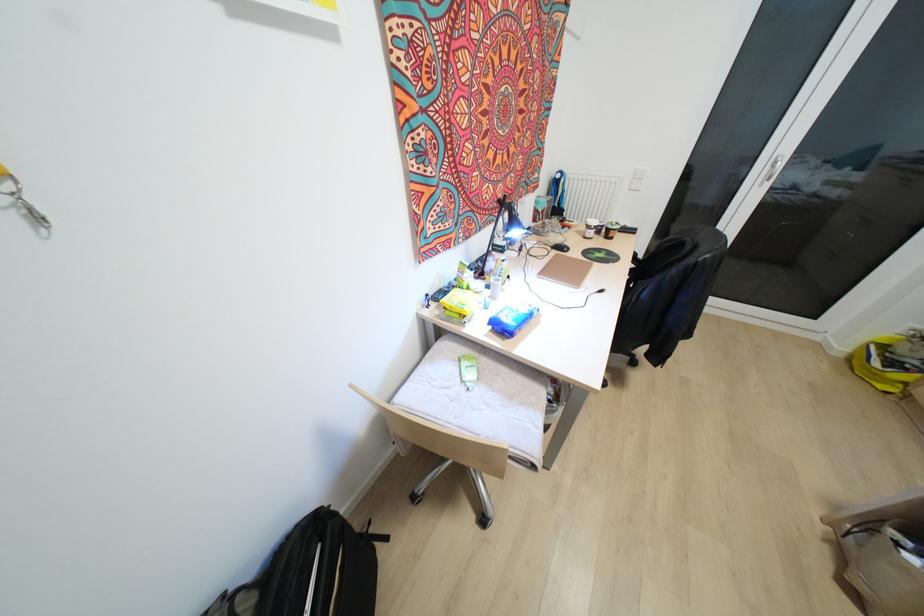
Find where to sit the chair sitting surface. Please return your answer as a coordinate pair (x, y).

(472, 394)